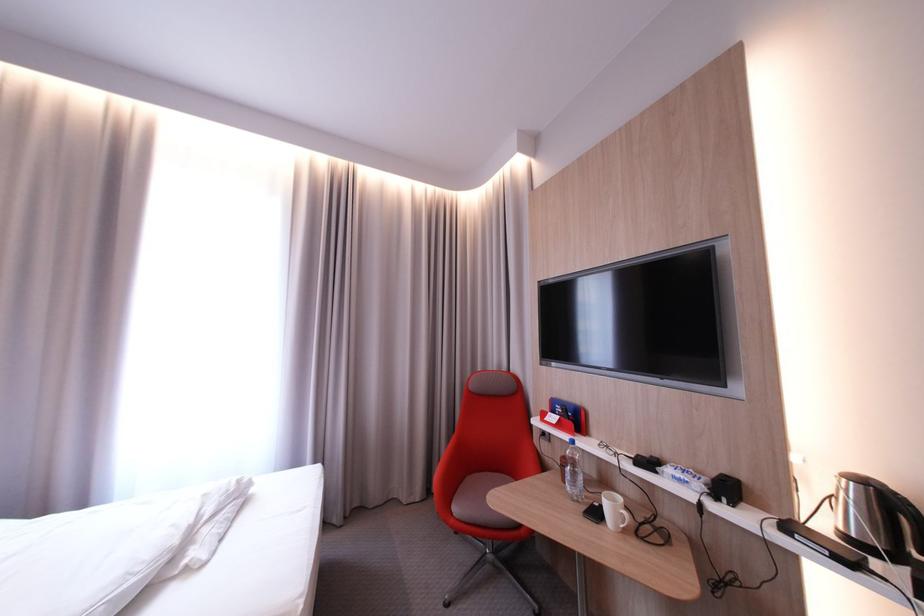
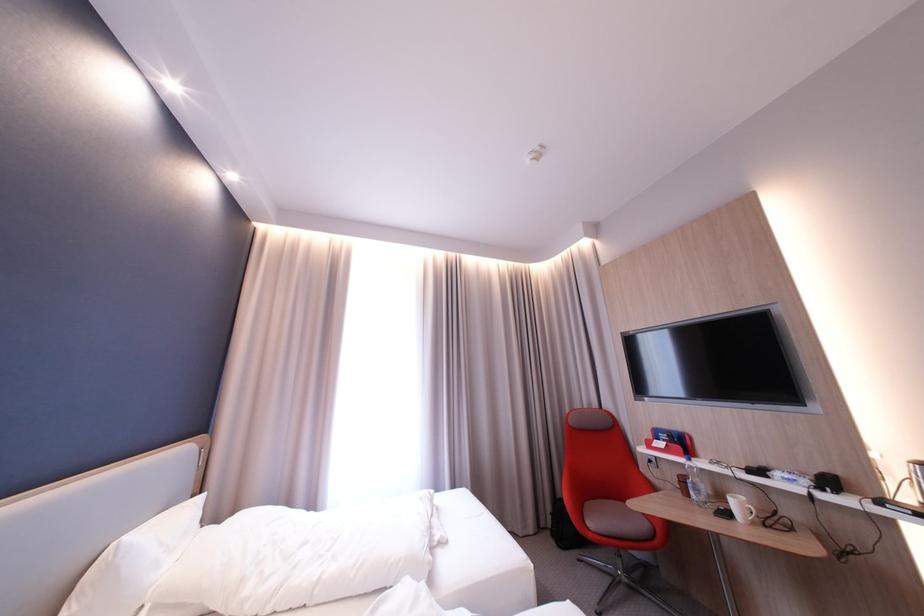
Question: The first image is from the beginning of the video and the second image is from the end. How did the camera likely rotate when shooting the video?

Choices:
 (A) Left
 (B) Right
 (C) Up
 (D) Down

Answer: (C)